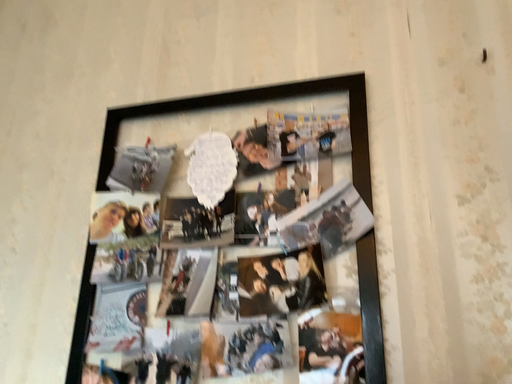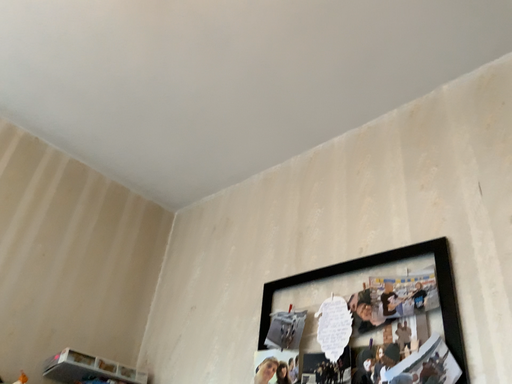
Question: How did the camera likely rotate when shooting the video?

Choices:
 (A) rotated left
 (B) rotated right

Answer: (A)